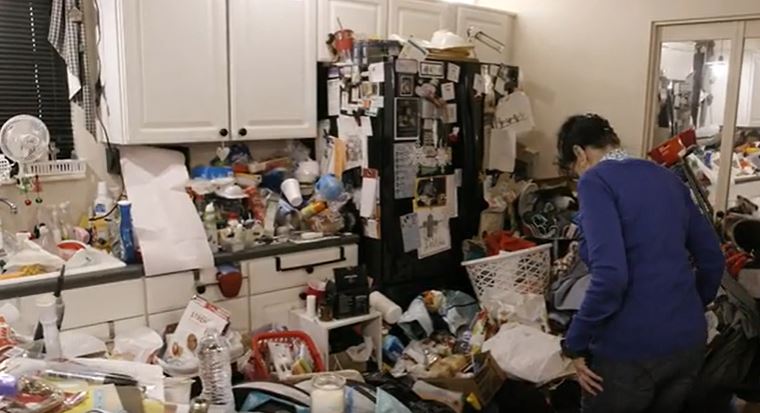
At what (x,y) coordinates should I click in order to perform the action: click on refrigerator. Please return your answer as a coordinate pair (x, y). Image resolution: width=760 pixels, height=413 pixels. Looking at the image, I should click on (464, 147).